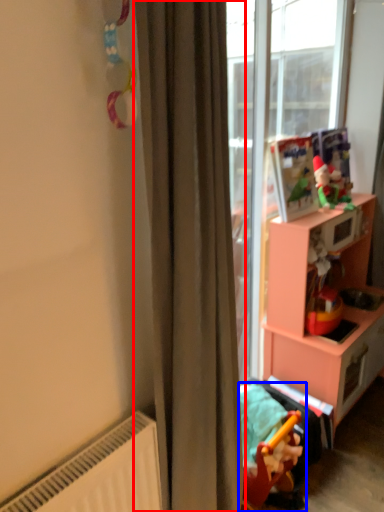
Question: Which of the following is the closest to the observer, curtain (highlighted by a red box) or toy (highlighted by a blue box)?

Choices:
 (A) curtain
 (B) toy

Answer: (A)